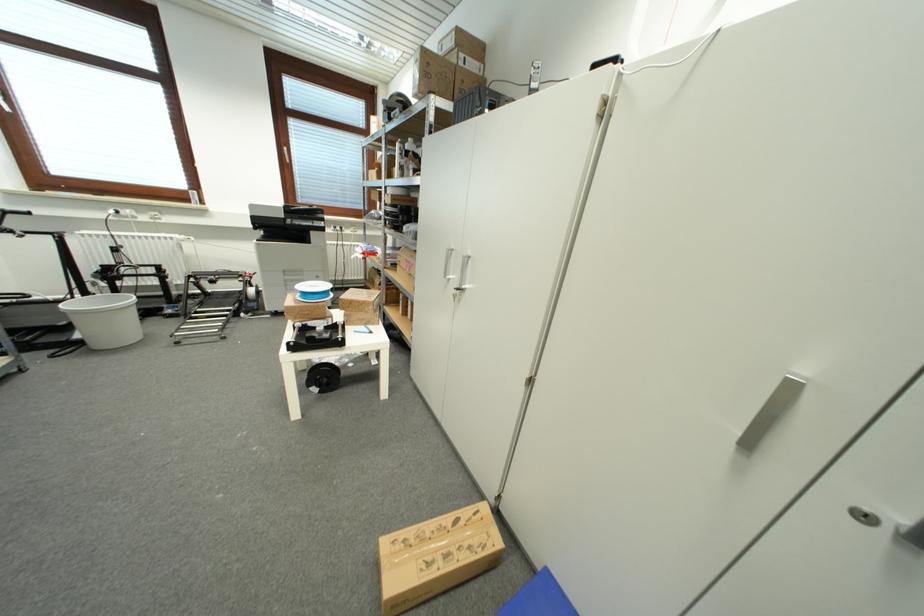
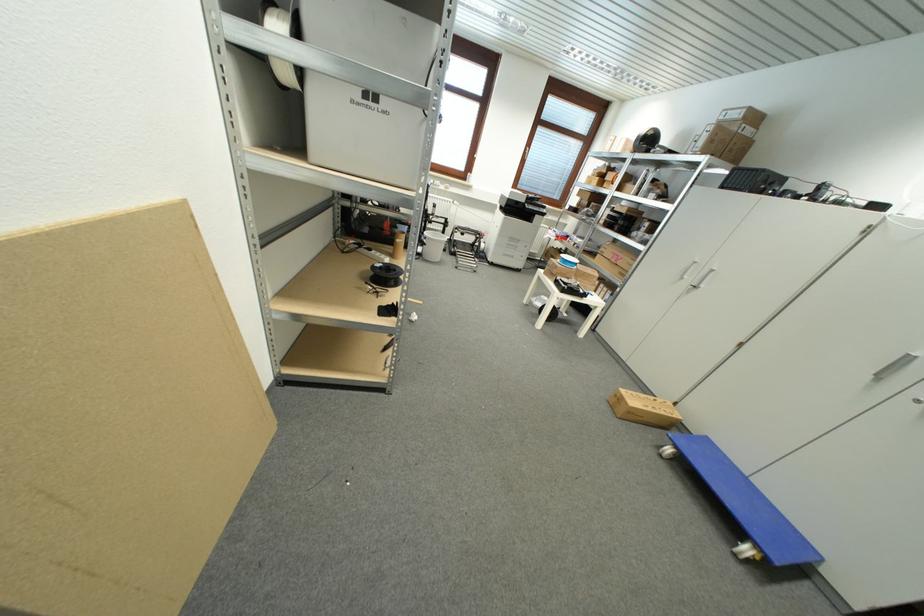
Locate, in the second image, the point that corresponds to (477,68) in the first image.

(754, 134)